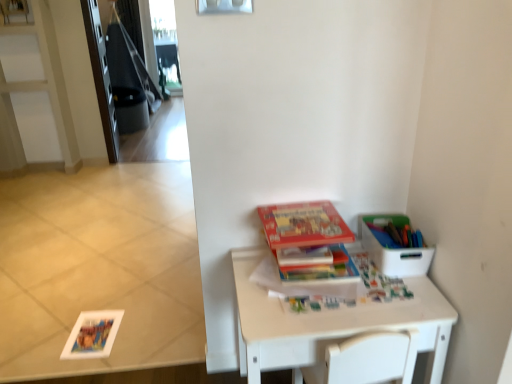
You are a GUI agent. You are given a task and a screenshot of the screen. Output one action in this format:
    pyautogui.click(x=<x>, y=<y>)
    Task: Click on the free location in front of white plastic container at right
    The height and width of the screenshot is (384, 512).
    Given the screenshot: What is the action you would take?
    pyautogui.click(x=398, y=299)